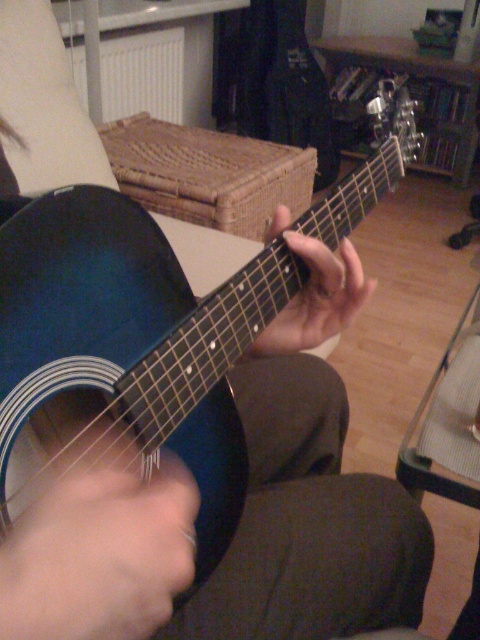
You are a delivery person trying to place a package that is 5 feet long on the floor between the shiny blue acoustic guitar at center and the white matte radiator at upper left. Can the package fit in that space?

The shiny blue acoustic guitar at center is 5.33 feet from the white matte radiator at upper left, so the 5 feet long package can fit in that space since it is shorter than the distance between them.

You are a photographer setting up a shoot in this room. You want to position a light source above the shiny blue acoustic guitar at center so it casts a shadow towards the white matte radiator at upper left. Is this possible given their positions?

The shiny blue acoustic guitar at center is located below the white matte radiator at upper left, so placing a light source above the guitar would cast a shadow downward away from the radiator, not towards it. Therefore, it is not possible to cast a shadow towards the radiator with the light positioned above the guitar.